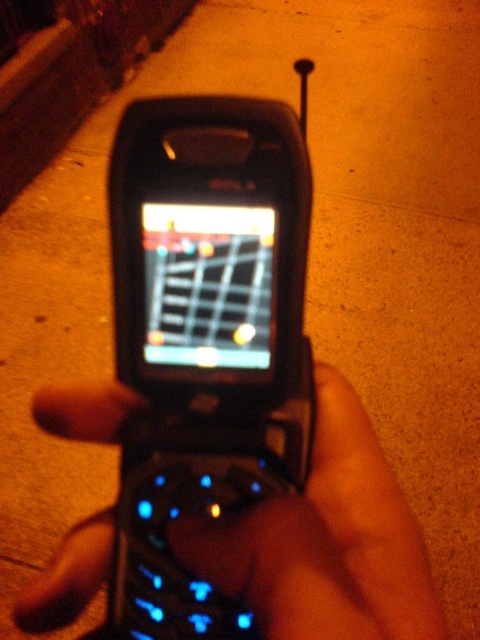
Can you confirm if black matte phone at center is positioned to the left of concrete at upper left?

Incorrect, black matte phone at center is not on the left side of concrete at upper left.

Can you confirm if black matte phone at center is positioned to the right of concrete at upper left?

Correct, you'll find black matte phone at center to the right of concrete at upper left.

At what (x,y) coordinates should I click in order to perform the action: click on black matte phone at center. Please return your answer as a coordinate pair (x, y). The image size is (480, 640). Looking at the image, I should click on (325, 541).